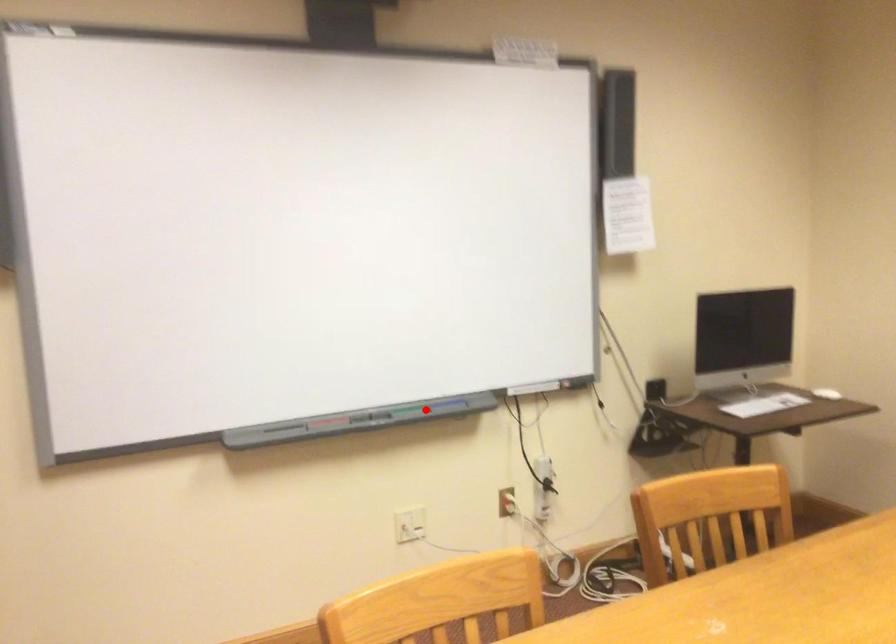
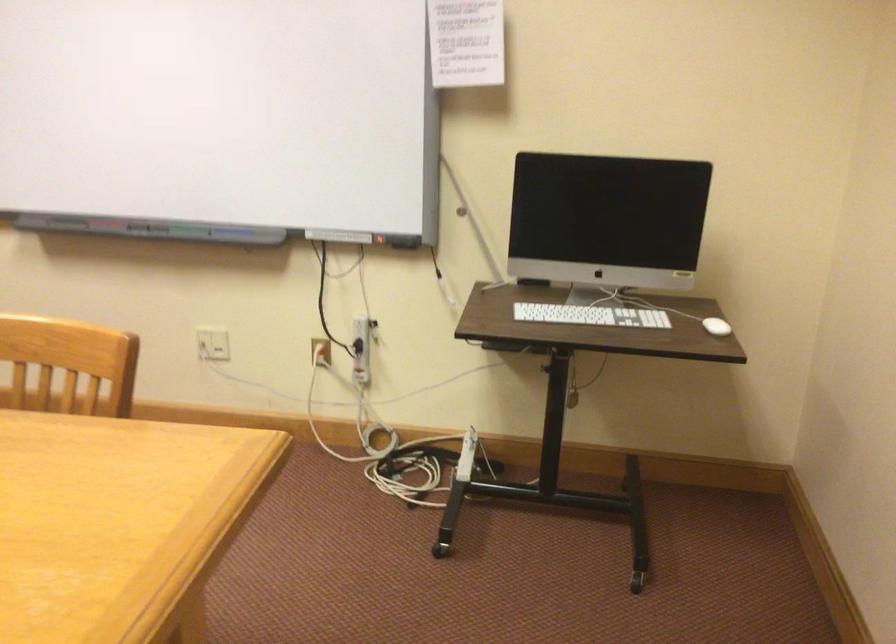
Find the pixel in the second image that matches the highlighted location in the first image.

(187, 230)